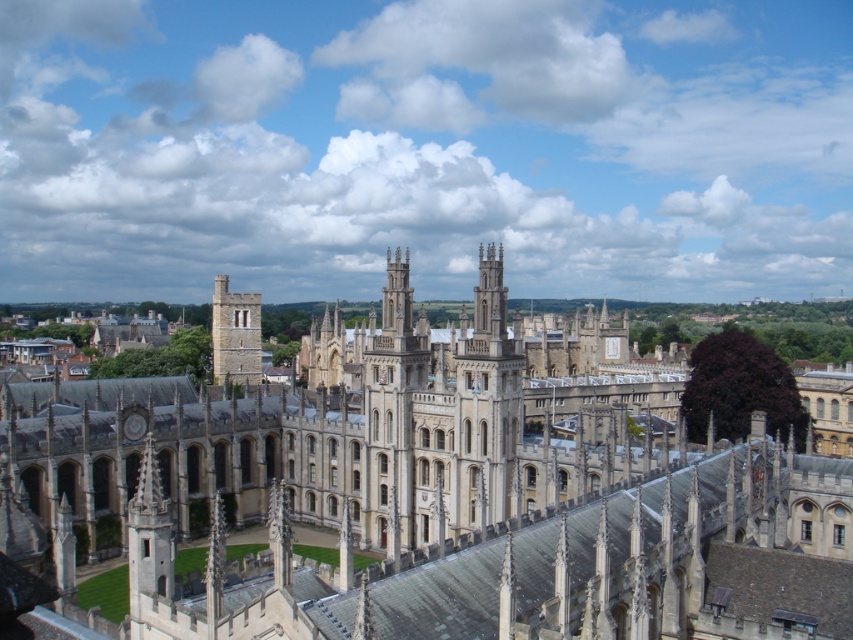
You are standing at the entrance of the university campus and want to take a photo of the beige stone cathedral at center. Given its coordinates at point 0.780, 0.513, where should you position yourself to ensure it is centered in your frame?

To center the beige stone cathedral at center in your frame, position yourself directly in front of its coordinates at point (437, 499), ensuring the cathedral is aligned with the center of your camera viewfinder.